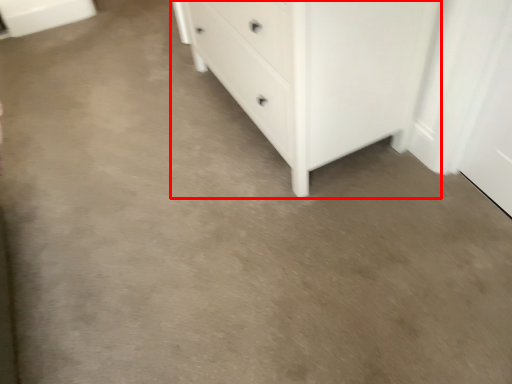
Question: From the image's perspective, where is chest of drawers (annotated by the red box) located in relation to cabinetry in the image?

Choices:
 (A) below
 (B) above

Answer: (A)